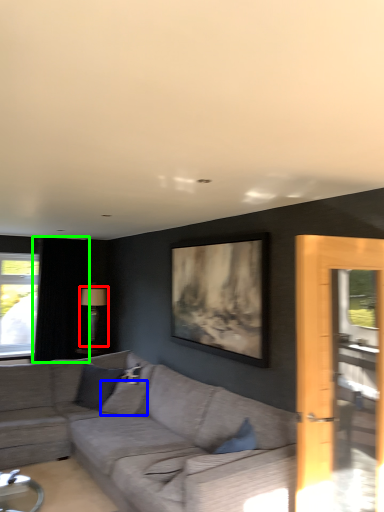
Question: Based on their relative distances, which object is farther from lamp (highlighted by a red box)? Choose from pillow (highlighted by a blue box) and curtain (highlighted by a green box).

Choices:
 (A) pillow
 (B) curtain

Answer: (A)